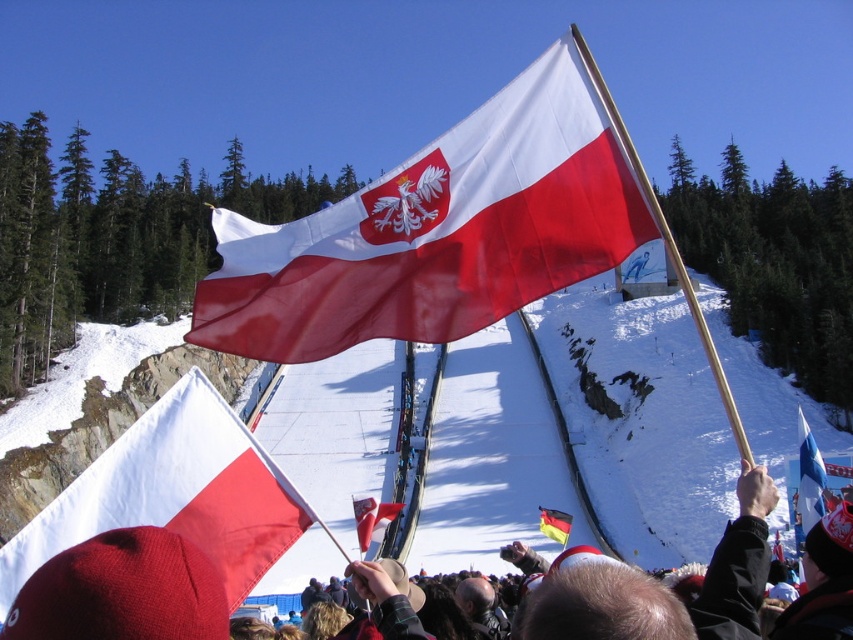
The height and width of the screenshot is (640, 853). What do you see at coordinates (120, 592) in the screenshot? I see `matte red hat at center` at bounding box center [120, 592].

Can you confirm if matte red hat at center is shorter than matte red flag at center?

Yes.

Which is in front, point (558, 618) or point (355, 499)?

Point (558, 618) is in front.

The image size is (853, 640). I want to click on matte red hat at center, so click(120, 592).

Can you confirm if white matte flag at center is smaller than white fabric flag at right?

Yes.

You are a GUI agent. You are given a task and a screenshot of the screen. Output one action in this format:
    pyautogui.click(x=<x>, y=<y>)
    Task: Click on the white matte flag at center
    This screenshot has height=640, width=853.
    Given the screenshot: What is the action you would take?
    click(173, 493)

Is matte fabric flag at center in front of white matte flag at center?

No, it is behind white matte flag at center.

The width and height of the screenshot is (853, 640). I want to click on matte fabric flag at center, so click(440, 228).